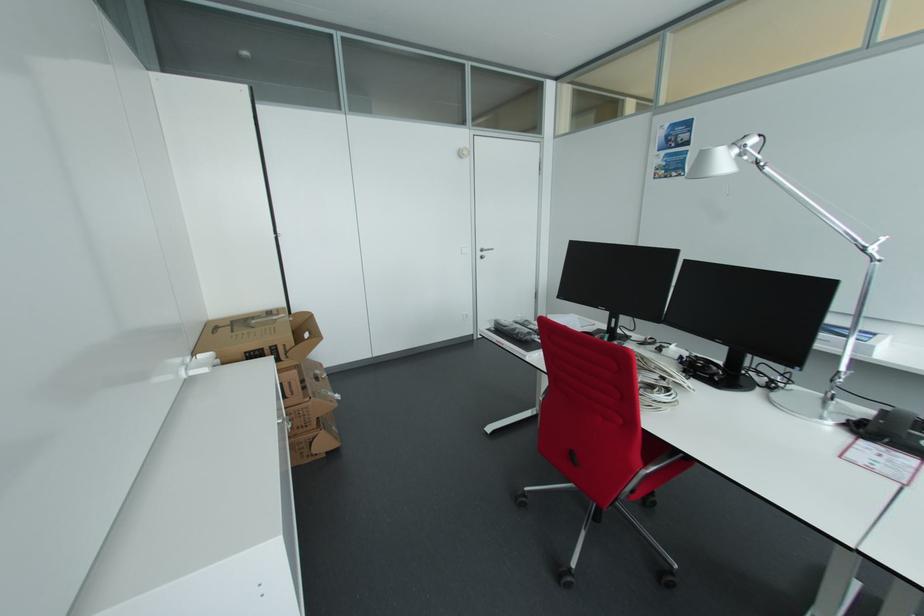
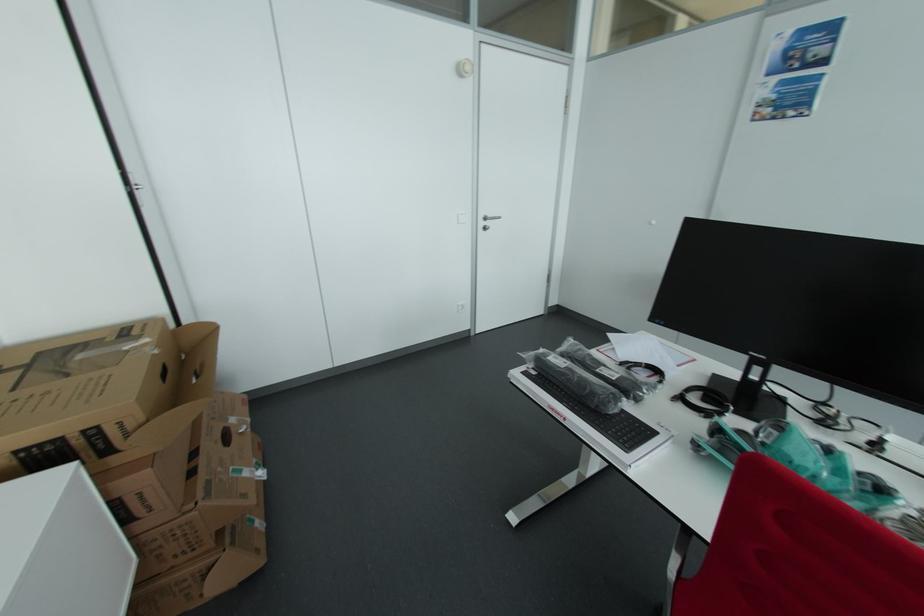
Locate, in the second image, the point that corresponds to point 326,378 in the first image.

(245, 432)